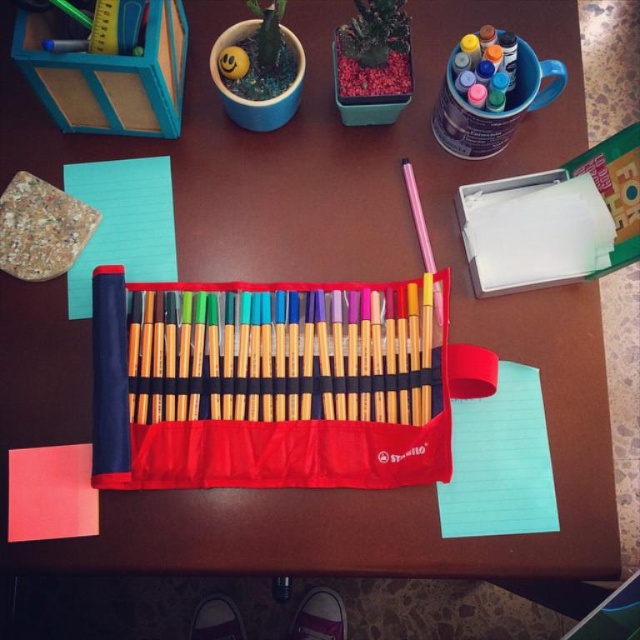
Is matte fabric pencil case at center thinner than light blue paper at center?

No, matte fabric pencil case at center is not thinner than light blue paper at center.

Between point (337, 484) and point (152, 212), which one is positioned in front?

Positioned in front is point (337, 484).

This screenshot has height=640, width=640. I want to click on matte fabric pencil case at center, so click(x=275, y=384).

From the picture: Is the position of light blue paper at center more distant than that of red matte notepad at lower left?

Yes, light blue paper at center is behind red matte notepad at lower left.

Consider the image. Can you confirm if light blue paper at center is thinner than red matte notepad at lower left?

No.

This screenshot has width=640, height=640. I want to click on light blue paper at center, so click(122, 224).

Where is `light blue paper at center`? The width and height of the screenshot is (640, 640). light blue paper at center is located at coordinates (122, 224).

From the picture: Is light blue paper at lower right further to camera compared to red matte notepad at lower left?

That is True.

Between point (476, 458) and point (33, 518), which one is positioned in front?

Point (33, 518)

Identify the location of light blue paper at lower right. pyautogui.click(x=499, y=461).